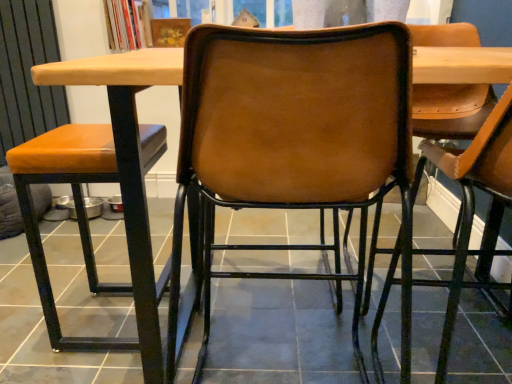
Question: Would you say matte brown tile at center is inside or outside orange leather stool at left, which is the 1th chair from left to right?

Choices:
 (A) inside
 (B) outside

Answer: (B)

Question: Considering their positions, is matte brown tile at center located in front of or behind orange leather stool at left, which is the 1th chair from left to right?

Choices:
 (A) behind
 (B) front

Answer: (A)

Question: Based on their relative distances, which object is farther from the orange leather stool at left, the 3th chair viewed from the right?

Choices:
 (A) leather-like brown chair at center, marked as the 1th chair in a right-to-left arrangement
 (B) brown leather chair at center, arranged as the 2th chair when viewed from the left
 (C) matte brown tile at center

Answer: (A)

Question: Estimate the real-world distances between objects in this image. Which object is closer to the matte brown tile at center?

Choices:
 (A) orange leather stool at left, which is the 1th chair from left to right
 (B) leather-like brown chair at center, marked as the 1th chair in a right-to-left arrangement
 (C) brown leather chair at center, which is the 2th chair from right to left

Answer: (C)